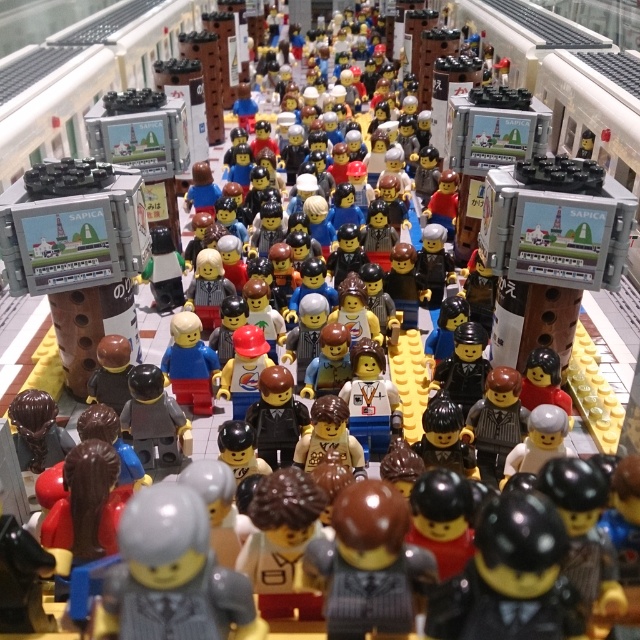
Question: Does black glossy minifigure at center appear over brown fabric minifigure at center?

Choices:
 (A) yes
 (B) no

Answer: (A)

Question: Does white matte minifigure at center have a smaller size compared to matte black suit at center?

Choices:
 (A) yes
 (B) no

Answer: (A)

Question: Which object is the farthest from the brown fabric minifigure at center?

Choices:
 (A) white matte minifigure at center
 (B) matte plastic figure at center
 (C) matte black minifigure at center

Answer: (B)

Question: Among these objects, which one is nearest to the camera?

Choices:
 (A) matte black minifigure at center
 (B) matte plastic figure at center

Answer: (A)

Question: Can you confirm if black glossy minifigure at center is bigger than matte black suit at center?

Choices:
 (A) yes
 (B) no

Answer: (A)

Question: Which of these objects is positioned farthest from the matte gray suit at center?

Choices:
 (A) black glossy minifigure at center
 (B) white matte minifigure at center

Answer: (B)